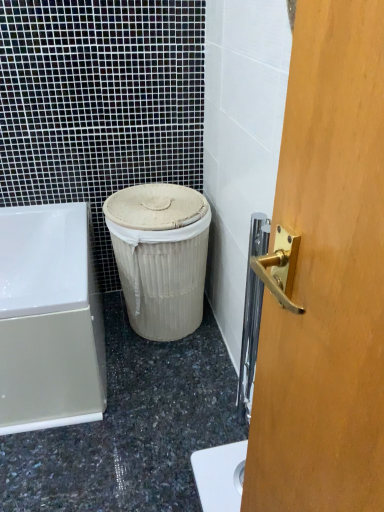
I want to click on unoccupied area in front of beige woven basket at center, so click(x=166, y=376).